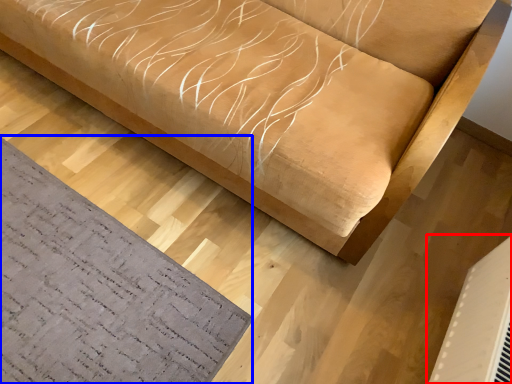
Question: Which object appears closest to the camera in this image, air conditioning (highlighted by a red box) or mat (highlighted by a blue box)?

Choices:
 (A) air conditioning
 (B) mat

Answer: (A)